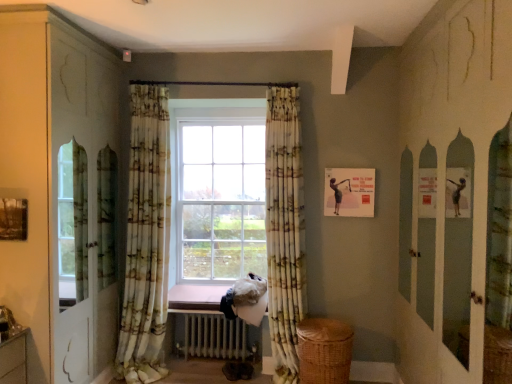
Question: From their relative heights in the image, would you say printed fabric curtain at center, which appears as the first curtain when viewed from the right, is taller or shorter than white metallic radiator at center?

Choices:
 (A) short
 (B) tall

Answer: (B)

Question: In the image, is printed fabric curtain at center, which appears as the first curtain when viewed from the right, on the left side or the right side of white metallic radiator at center?

Choices:
 (A) left
 (B) right

Answer: (B)

Question: Based on their relative distances, which object is nearer to the printed fabric curtain at center, positioned as the second curtain in left-to-right order?

Choices:
 (A) pink wood at center
 (B) white glossy dresser at left
 (C) white metallic radiator at center
 (D) matte paper picture frame at upper right
 (E) floral fabric curtain at center, placed as the 2th curtain when sorted from right to left

Answer: (D)

Question: Which is farther from the white glossy dresser at left?

Choices:
 (A) white metallic radiator at center
 (B) printed fabric curtain at center, positioned as the second curtain in left-to-right order
 (C) floral fabric curtain at center, which appears as the 1th curtain when viewed from the left
 (D) woven brown basket at lower right
 (E) pink wood at center

Answer: (D)